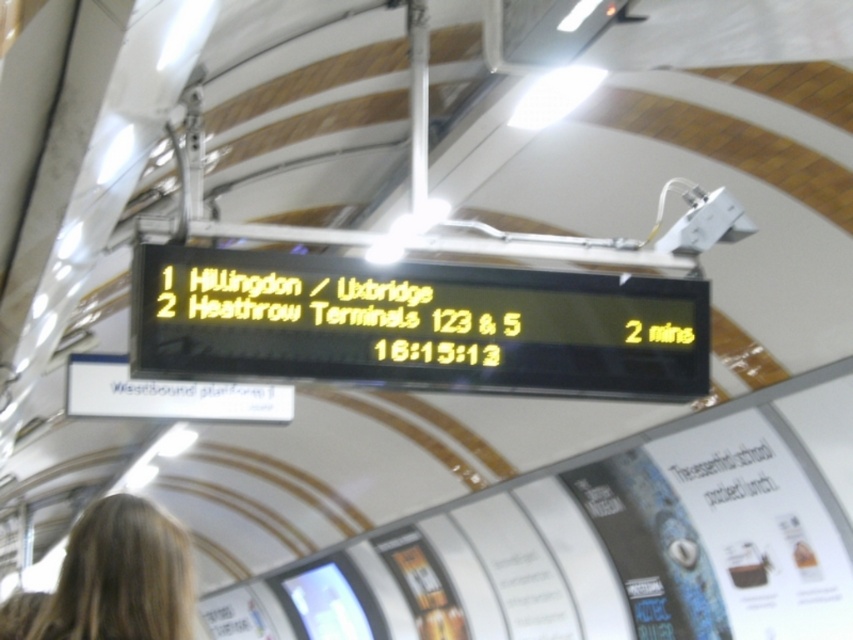
You are a passenger waiting at the station platform. You see the yellow led display at center and the blonde hair at lower left. Which object is taller?

The yellow led display at center is taller than blonde hair at lower left.

You are a passenger waiting at the station and see the yellow led display at center and the blonde hair at lower left. Which object is closer to you?

The yellow led display at center is closer to you because the blonde hair at lower left is behind it.